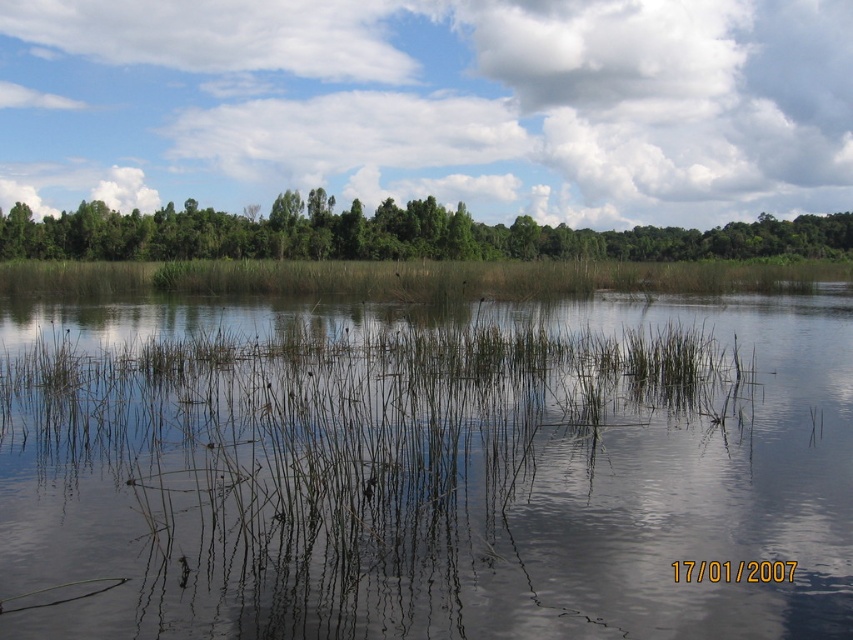
Question: Which object is the farthest from the white fluffy cloud at upper center?

Choices:
 (A) translucent water at center
 (B) white fluffy cloud at upper left
 (C) green leafy trees at upper center

Answer: (A)

Question: Which of the following is the farthest from the observer?

Choices:
 (A) white fluffy cloud at upper left
 (B) green leafy trees at upper center
 (C) green grass at center

Answer: (A)

Question: Which of the following is the farthest from the observer?

Choices:
 (A) (370, 20)
 (B) (805, 308)

Answer: (A)

Question: From the image, what is the correct spatial relationship of green leafy trees at upper center in relation to white fluffy cloud at upper left?

Choices:
 (A) below
 (B) above

Answer: (A)

Question: Does translucent water at center appear over green grass at center?

Choices:
 (A) no
 (B) yes

Answer: (A)

Question: Is translucent water at center below white fluffy cloud at upper center?

Choices:
 (A) yes
 (B) no

Answer: (A)